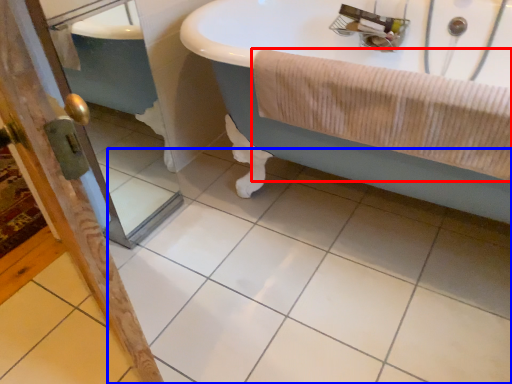
Question: Which of the following is the farthest to the observer, bath towel (highlighted by a red box) or ceramic tile (highlighted by a blue box)?

Choices:
 (A) bath towel
 (B) ceramic tile

Answer: (A)